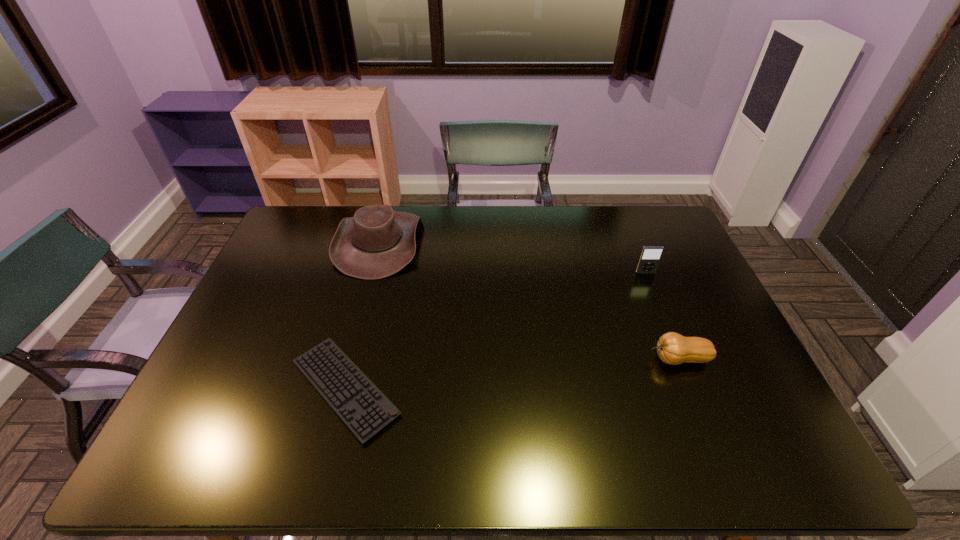
Find the location of a particular element. This screenshot has height=540, width=960. cowboy hat is located at coordinates (377, 242).

You are a GUI agent. You are given a task and a screenshot of the screen. Output one action in this format:
    pyautogui.click(x=<x>, y=<y>)
    Task: Click on the third shortest object
    The height and width of the screenshot is (540, 960).
    Given the screenshot: What is the action you would take?
    pyautogui.click(x=650, y=256)

The image size is (960, 540). I want to click on gourd, so click(x=672, y=348).

Find the location of a particular element. This screenshot has height=540, width=960. computer keyboard is located at coordinates (365, 410).

The image size is (960, 540). In order to click on vacant position located 0.390m on the front of the cowboy hat in this screenshot , I will do `click(341, 384)`.

Find the location of a particular element. The height and width of the screenshot is (540, 960). blank space located on the front-facing side of the second tallest object is located at coordinates (674, 345).

Where is `vacant region located on the stem side of the second shortest object`? This screenshot has height=540, width=960. vacant region located on the stem side of the second shortest object is located at coordinates (543, 359).

In order to click on blank space located 0.310m on the stem side of the second shortest object in this screenshot , I will do `click(532, 359)`.

In order to click on vacant space located on the stem side of the second shortest object in this screenshot , I will do `click(510, 359)`.

This screenshot has height=540, width=960. Identify the location of vacant space positioned on the left of the computer keyboard. (257, 388).